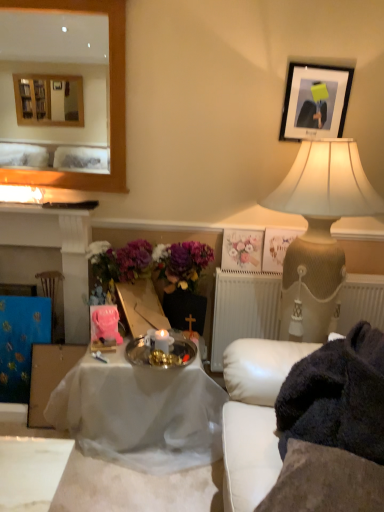
Question: Considering the relative positions of silver metallic tray at center and pastel floral print at upper center in the image provided, is silver metallic tray at center to the left or to the right of pastel floral print at upper center?

Choices:
 (A) left
 (B) right

Answer: (A)

Question: Considering the positions of silver metallic tray at center and pastel floral print at upper center in the image, is silver metallic tray at center taller or shorter than pastel floral print at upper center?

Choices:
 (A) short
 (B) tall

Answer: (A)

Question: Estimate the real-world distances between objects in this image. Which object is farther from the beige textured lamp at upper right?

Choices:
 (A) white textured radiator at center
 (B) black matte picture frame at upper right, the 1th picture frame positioned from the top
 (C) matte black fireplace at left
 (D) wooden picture frame at upper right, which is counted as the 2th picture frame, starting from the top
 (E) blue fabric tablecloth at left

Answer: (E)

Question: Which object is positioned closest to the matte black fireplace at left?

Choices:
 (A) white cloth-covered table at center
 (B) blue fabric tablecloth at left
 (C) wooden picture frame at upper right, which is the 2th picture frame from front to back
 (D) black matte picture frame at upper right, the 1th picture frame in the front-to-back sequence
 (E) pastel floral print at upper center

Answer: (B)